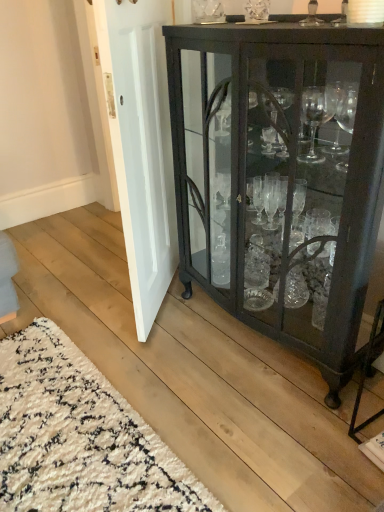
Question: Is point (127, 251) positioned closer to the camera than point (79, 442)?

Choices:
 (A) closer
 (B) farther

Answer: (B)

Question: Considering their positions, is white painted wood door at center located in front of or behind white shaggy rug at lower left?

Choices:
 (A) front
 (B) behind

Answer: (B)

Question: Which of these objects is positioned farthest from the white painted wood door at center?

Choices:
 (A) matte black cabinet at right
 (B) white shaggy rug at lower left

Answer: (B)

Question: Estimate the real-world distances between objects in this image. Which object is closer to the white painted wood door at center?

Choices:
 (A) white shaggy rug at lower left
 (B) matte black cabinet at right

Answer: (B)